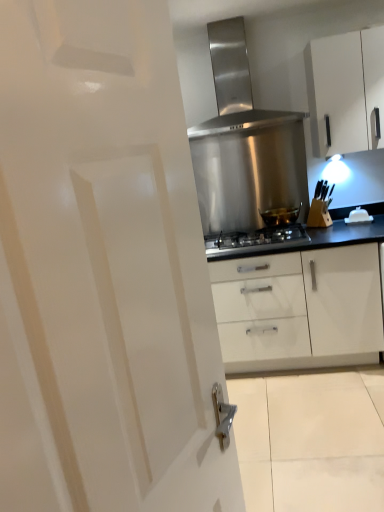
Question: Is the surface of stainless steel gas stove at center in direct contact with white glossy kettle at upper right?

Choices:
 (A) no
 (B) yes

Answer: (A)

Question: Is stainless steel gas stove at center facing away from white glossy kettle at upper right?

Choices:
 (A) no
 (B) yes

Answer: (A)

Question: From the image's perspective, is stainless steel gas stove at center above white glossy kettle at upper right?

Choices:
 (A) no
 (B) yes

Answer: (A)

Question: From a real-world perspective, is stainless steel gas stove at center under white glossy kettle at upper right?

Choices:
 (A) yes
 (B) no

Answer: (A)

Question: Does stainless steel gas stove at center lie in front of white glossy kettle at upper right?

Choices:
 (A) yes
 (B) no

Answer: (A)

Question: Is stainless steel gas stove at center far away from white glossy kettle at upper right?

Choices:
 (A) no
 (B) yes

Answer: (A)

Question: Could you tell me if white glossy kettle at upper right is turned towards stainless steel range hood at upper center?

Choices:
 (A) yes
 (B) no

Answer: (B)

Question: Is white glossy kettle at upper right not inside stainless steel range hood at upper center?

Choices:
 (A) yes
 (B) no

Answer: (A)

Question: Would you say stainless steel range hood at upper center is part of white glossy kettle at upper right's contents?

Choices:
 (A) no
 (B) yes

Answer: (A)

Question: Is white glossy kettle at upper right positioned in front of stainless steel range hood at upper center?

Choices:
 (A) yes
 (B) no

Answer: (B)

Question: From the image's perspective, is white glossy kettle at upper right over stainless steel range hood at upper center?

Choices:
 (A) no
 (B) yes

Answer: (A)

Question: Is white glossy kettle at upper right facing away from stainless steel range hood at upper center?

Choices:
 (A) no
 (B) yes

Answer: (A)

Question: Does shiny metallic pot at center lie behind white glossy door at center?

Choices:
 (A) yes
 (B) no

Answer: (A)